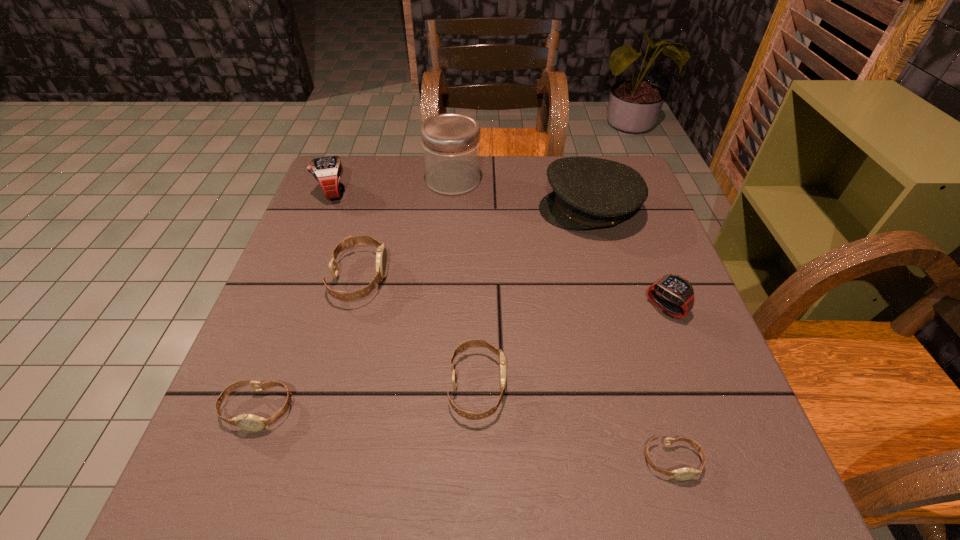
Image resolution: width=960 pixels, height=540 pixels. Identify the location of free area in between the biggest beige watch and the smallest beige watch. (516, 369).

You are a GUI agent. You are given a task and a screenshot of the screen. Output one action in this format:
    pyautogui.click(x=<x>, y=<y>)
    Task: Click on the free space that is in between the nearer red watch and the nearest watch
    Image resolution: width=960 pixels, height=540 pixels.
    Given the screenshot: What is the action you would take?
    pyautogui.click(x=669, y=384)

The image size is (960, 540). Find the location of `free space between the second shortest watch and the gray beret`. free space between the second shortest watch and the gray beret is located at coordinates (423, 309).

The height and width of the screenshot is (540, 960). Identify the location of vacant space in between the beret and the biggest beige watch. (474, 244).

Identify the location of free space between the third shortest object and the third biggest beige watch. This screenshot has width=960, height=540. (368, 398).

This screenshot has width=960, height=540. I want to click on object identified as the fifth closest to the nearest beige watch, so click(249, 422).

Identify which object is the seventh closest to the second tallest object. Please provide its 2D coordinates. Your answer should be formatted as a tuple, i.e. [(x, y)], where the tuple contains the x and y coordinates of a point satisfying the conditions above.

[(249, 422)]

Identify which watch is the nearest to the beret. Please provide its 2D coordinates. Your answer should be formatted as a tuple, i.e. [(x, y)], where the tuple contains the x and y coordinates of a point satisfying the conditions above.

[(677, 289)]

Choose which watch is the nearest neighbor to the second shortest watch. Please provide its 2D coordinates. Your answer should be formatted as a tuple, i.e. [(x, y)], where the tuple contains the x and y coordinates of a point satisfying the conditions above.

[(381, 255)]

Where is `the second closest beige watch to the biggest beige watch`? This screenshot has height=540, width=960. the second closest beige watch to the biggest beige watch is located at coordinates (249, 422).